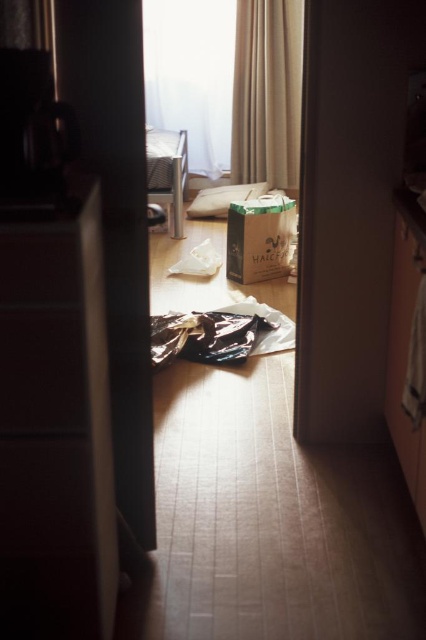
Question: Which point appears closest to the camera in this image?

Choices:
 (A) (241, 61)
 (B) (264, 234)
 (C) (207, 92)

Answer: (B)

Question: Is transparent fabric at upper center thinner than matte black drawer at left?

Choices:
 (A) no
 (B) yes

Answer: (A)

Question: Which object appears farthest from the camera in this image?

Choices:
 (A) transparent fabric at upper center
 (B) matte black drawer at left

Answer: (A)

Question: Is transparent fabric at upper center above matte black drawer at left?

Choices:
 (A) yes
 (B) no

Answer: (A)

Question: Can you confirm if matte black drawer at left is smaller than white paper bag at center?

Choices:
 (A) yes
 (B) no

Answer: (A)

Question: Which of the following is the farthest from the observer?

Choices:
 (A) transparent fabric at upper center
 (B) matte black drawer at left
 (C) white paper bag at center
 (D) beige fabric curtain at upper center

Answer: (A)